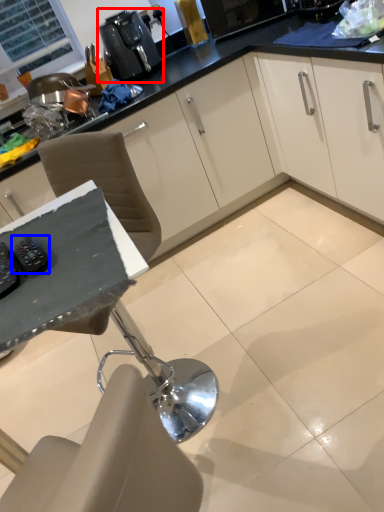
Question: Which point is further to the camera, coffee machine (highlighted by a red box) or appliance (highlighted by a blue box)?

Choices:
 (A) coffee machine
 (B) appliance

Answer: (A)